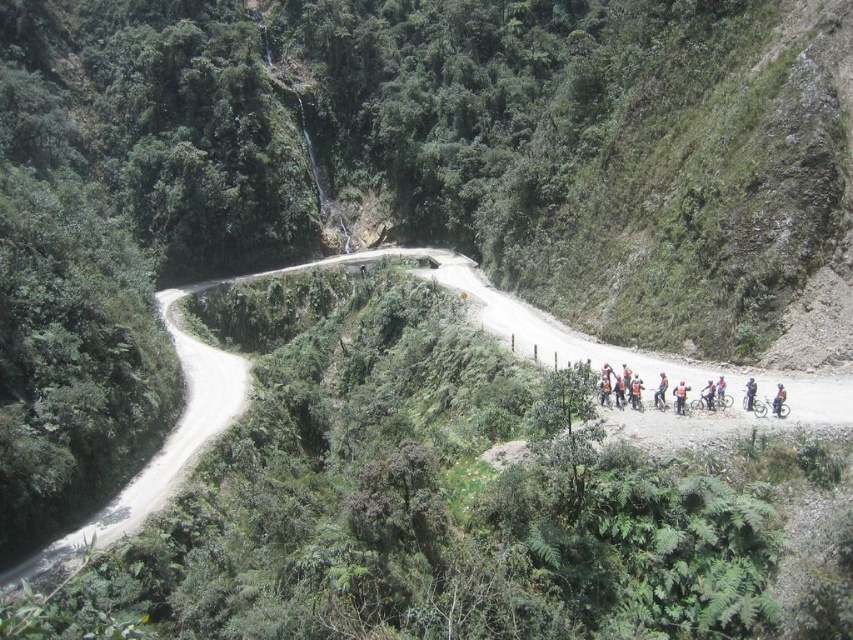
Question: Which of the following is the closest to the observer?

Choices:
 (A) blue fabric helmet at center
 (B) orange fabric cyclist at center

Answer: (A)

Question: Does orange fabric cyclist at center appear on the right side of blue fabric helmet at center?

Choices:
 (A) no
 (B) yes

Answer: (A)

Question: Can you confirm if orange fabric cyclist at center is smaller than blue fabric helmet at center?

Choices:
 (A) yes
 (B) no

Answer: (A)

Question: Is the position of orange fabric cyclist at center less distant than that of blue fabric helmet at center?

Choices:
 (A) yes
 (B) no

Answer: (B)